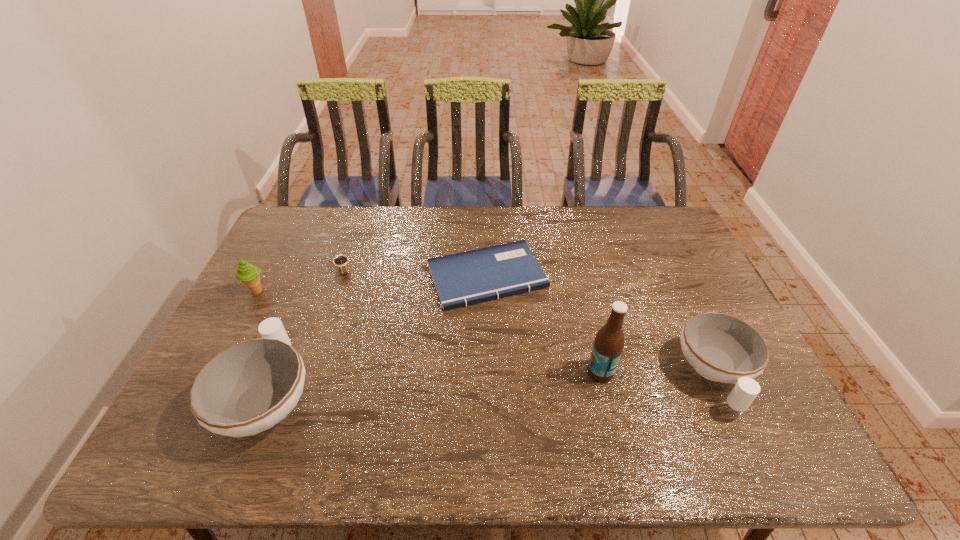
Identify the location of vacant space at the far edge of the desktop. (491, 226).

This screenshot has width=960, height=540. In the image, there is a desktop. What are the coordinates of `free space at the near edge` in the screenshot? It's located at (350, 414).

In the image, there is a desktop. Where is `vacant space at the far right corner`? The height and width of the screenshot is (540, 960). vacant space at the far right corner is located at coordinates (648, 242).

Where is `free space between the watch and the paperback book`? Image resolution: width=960 pixels, height=540 pixels. free space between the watch and the paperback book is located at coordinates (415, 273).

Identify the location of free space between the leftmost object and the shorter chinaware. pyautogui.click(x=486, y=333).

This screenshot has width=960, height=540. What are the coordinates of `free space between the fourth object from left to right and the fifth object from left to right` in the screenshot? It's located at (543, 324).

You are a GUI agent. You are given a task and a screenshot of the screen. Output one action in this format:
    pyautogui.click(x=<x>, y=<y>)
    Task: Click on the vacant space that's between the paperback book and the icecream
    
    Given the screenshot: What is the action you would take?
    pyautogui.click(x=372, y=284)

Image resolution: width=960 pixels, height=540 pixels. I want to click on vacant area between the third shortest object and the icecream, so click(486, 333).

Find the location of a particular element. vacant area that lies between the tallest object and the watch is located at coordinates (471, 320).

I want to click on blank region between the second object from right to left and the fourth tallest object, so click(x=658, y=373).